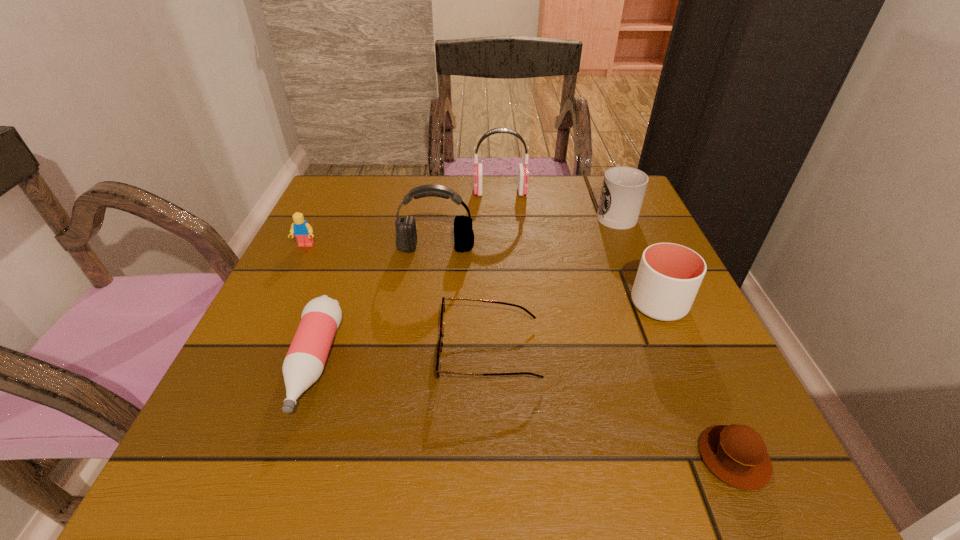
In order to click on free space that is in between the headset and the bottle in this screenshot , I will do `click(375, 306)`.

Where is `free point between the farther cup and the earphone`? The image size is (960, 540). free point between the farther cup and the earphone is located at coordinates (558, 202).

This screenshot has height=540, width=960. Identify the location of vacant area between the nearer cup and the spectacles. (574, 328).

Image resolution: width=960 pixels, height=540 pixels. In order to click on empty space that is in between the farther cup and the spectacles in this screenshot , I will do `click(552, 282)`.

Locate an element on the screen. This screenshot has height=540, width=960. object that can be found as the closest to the spectacles is located at coordinates (305, 360).

Identify which object is the third nearest to the farther cup. Please provide its 2D coordinates. Your answer should be formatted as a tuple, i.e. [(x, y)], where the tuple contains the x and y coordinates of a point satisfying the conditions above.

[(406, 239)]

This screenshot has width=960, height=540. Identify the location of vacant space that satisfies the following two spatial constraints: 1. on the back side of the nearer cup; 2. on the outer surface of the earphone. (610, 192).

The height and width of the screenshot is (540, 960). I want to click on vacant space that satisfies the following two spatial constraints: 1. on the outer surface of the earphone; 2. on the front-facing side of the fourth shortest object, so (x=504, y=246).

Locate an element on the screen. This screenshot has height=540, width=960. vacant space that satisfies the following two spatial constraints: 1. with the cap open on the bottle; 2. on the left side of the nearest object is located at coordinates (281, 457).

Where is `free point that satisfies the following two spatial constraints: 1. on the face of the nearest object; 2. on the right side of the spectacles`? The height and width of the screenshot is (540, 960). free point that satisfies the following two spatial constraints: 1. on the face of the nearest object; 2. on the right side of the spectacles is located at coordinates (492, 457).